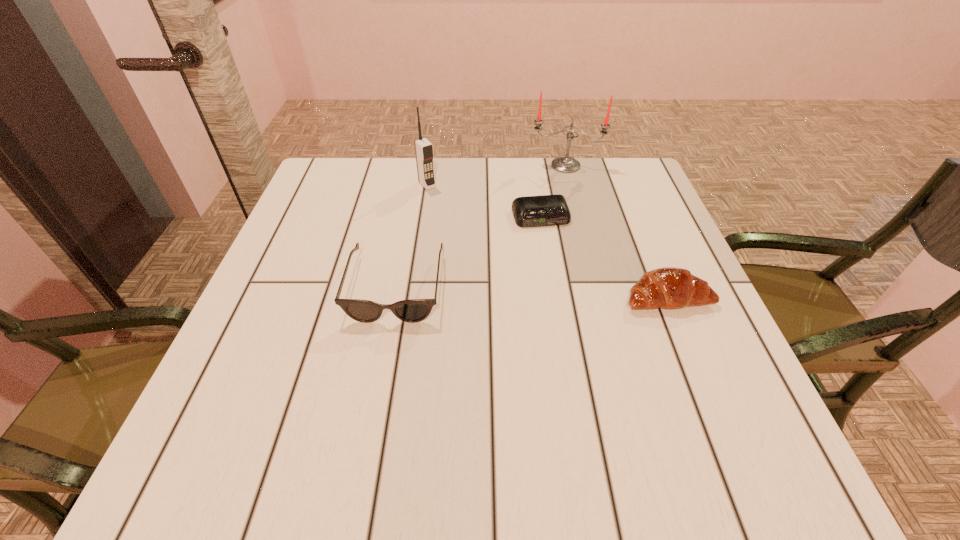
I want to click on free space between the candle and the second farthest object, so click(496, 175).

The width and height of the screenshot is (960, 540). What are the coordinates of `vacant area between the cellular telephone and the farthest object` in the screenshot? It's located at (496, 175).

The height and width of the screenshot is (540, 960). In order to click on free space between the cellular telephone and the alarm clock in this screenshot , I will do `click(484, 200)`.

Locate an element on the screen. This screenshot has height=540, width=960. vacant area that lies between the third farthest object and the farthest object is located at coordinates (553, 191).

You are a GUI agent. You are given a task and a screenshot of the screen. Output one action in this format:
    pyautogui.click(x=<x>, y=<y>)
    Task: Click on the free spot between the shortest object and the cellular telephone
    This screenshot has height=540, width=960.
    Given the screenshot: What is the action you would take?
    pyautogui.click(x=484, y=200)

At what (x,y) coordinates should I click in order to perform the action: click on free spot between the farthest object and the shortest object. Please return your answer as a coordinate pair (x, y). Looking at the image, I should click on (553, 191).

Identify the location of free space between the sunglasses and the farthest object. The width and height of the screenshot is (960, 540). (481, 226).

The height and width of the screenshot is (540, 960). Identify the location of unoccupied area between the cellular telephone and the third farthest object. (484, 200).

Where is `free space between the cellular telephone and the crescent roll`? Image resolution: width=960 pixels, height=540 pixels. free space between the cellular telephone and the crescent roll is located at coordinates (547, 241).

The height and width of the screenshot is (540, 960). What are the coordinates of `the closest object relative to the crescent roll` in the screenshot? It's located at coord(532,211).